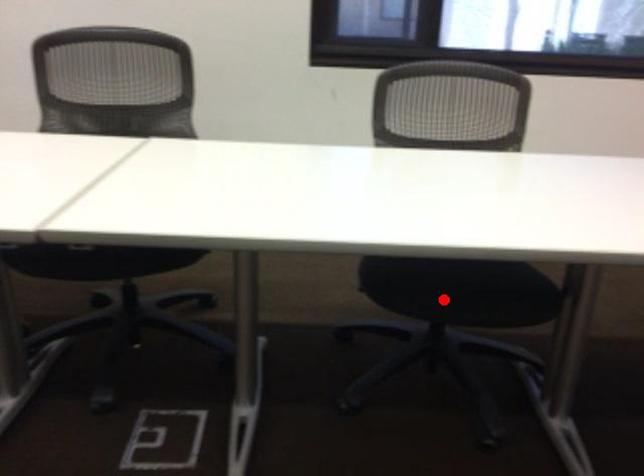
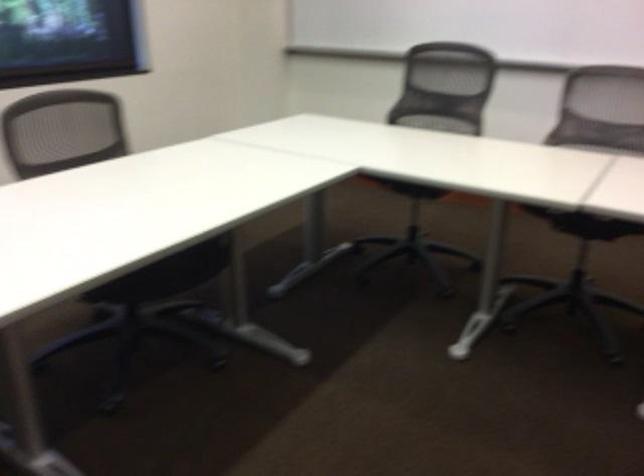
Question: I am providing you with two images of the same scene from different viewpoints. A red point is shown in image1. For the corresponding object point in image2, is it positioned nearer or farther from the camera?

Choices:
 (A) Nearer
 (B) Farther

Answer: (B)